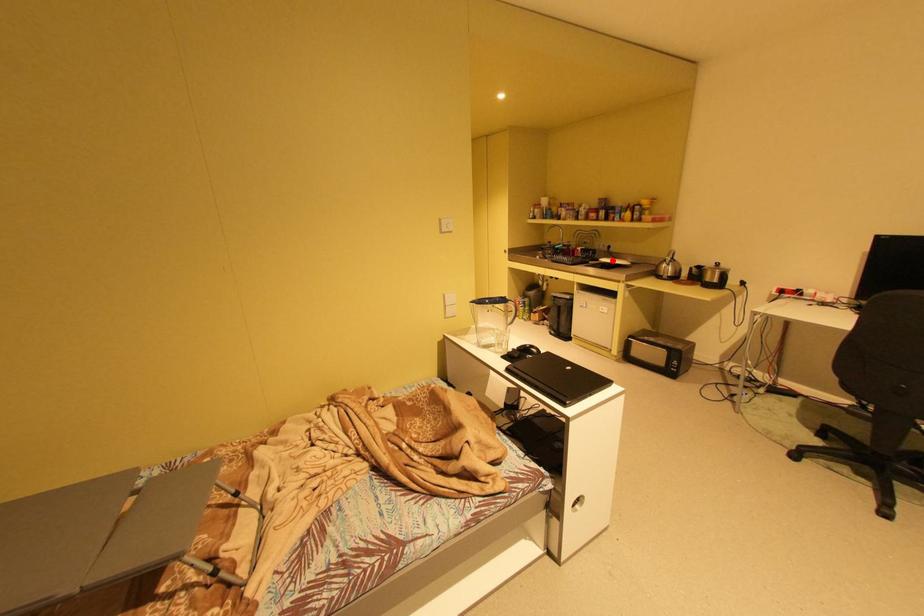
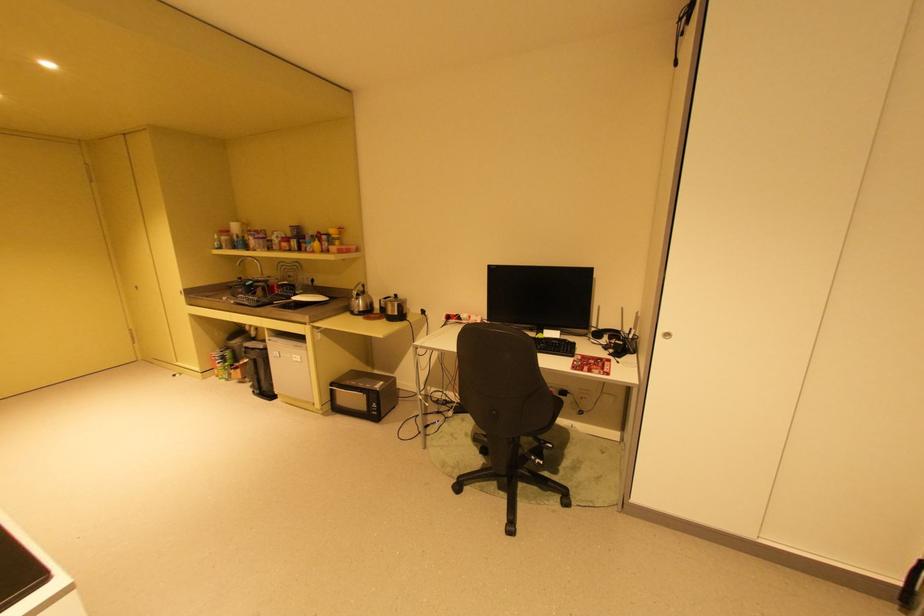
In the second image, find the point that corresponds to the highlighted location in the first image.

(304, 299)